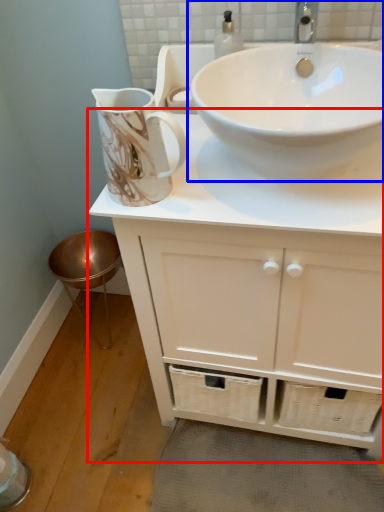
Question: Which object is closer to the camera taking this photo, bathroom cabinet (highlighted by a red box) or sink (highlighted by a blue box)?

Choices:
 (A) bathroom cabinet
 (B) sink

Answer: (A)